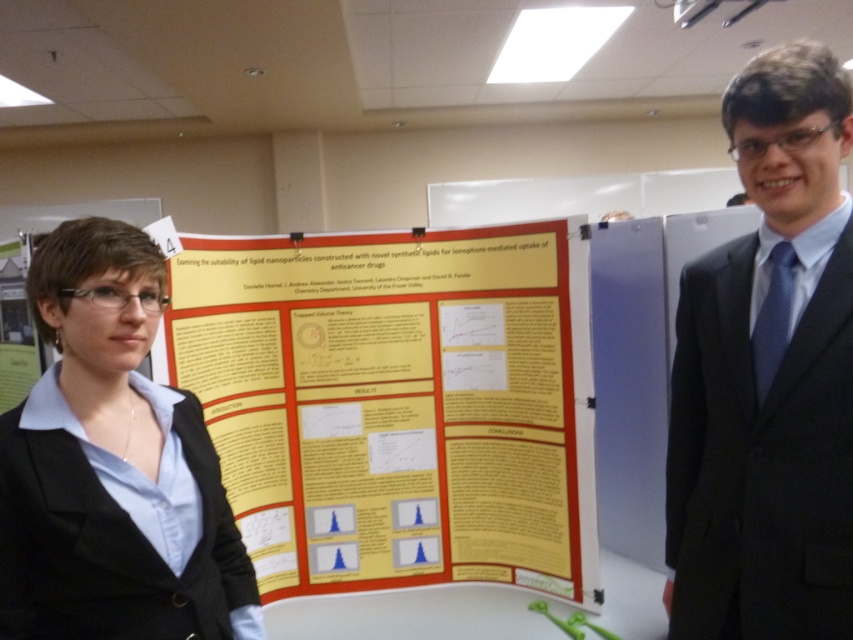
Question: Can you confirm if yellow paper poster at center is positioned to the right of black matte blazer at center?

Choices:
 (A) no
 (B) yes

Answer: (B)

Question: Can you confirm if black suit at right is positioned below black matte blazer at center?

Choices:
 (A) yes
 (B) no

Answer: (B)

Question: Which point is closer to the camera taking this photo?

Choices:
 (A) (537, 250)
 (B) (73, 372)

Answer: (B)

Question: Which object appears farthest from the camera in this image?

Choices:
 (A) yellow paper poster at center
 (B) black suit at right

Answer: (A)

Question: Can you confirm if yellow paper poster at center is bigger than black matte blazer at center?

Choices:
 (A) no
 (B) yes

Answer: (B)

Question: Which object is the farthest from the yellow paper poster at center?

Choices:
 (A) black matte blazer at center
 (B) black suit at right

Answer: (A)